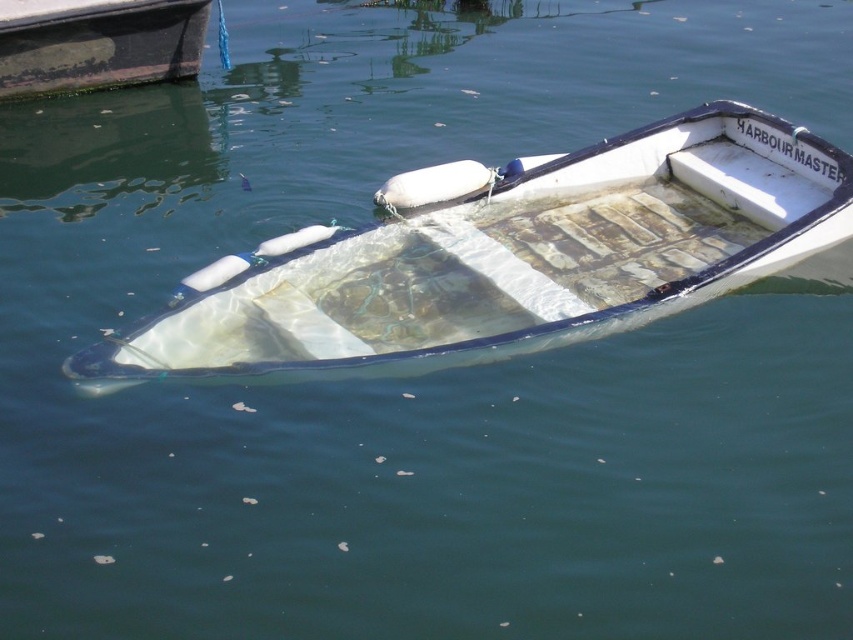
Question: Which object is farther from the camera taking this photo?

Choices:
 (A) rusty metal boat at upper left
 (B) transparent plastic boat at center

Answer: (A)

Question: Which point appears closest to the camera in this image?

Choices:
 (A) (15, 16)
 (B) (444, 179)

Answer: (B)

Question: Is transparent plastic boat at center positioned before rusty metal boat at upper left?

Choices:
 (A) yes
 (B) no

Answer: (A)

Question: Does transparent plastic boat at center come behind rusty metal boat at upper left?

Choices:
 (A) no
 (B) yes

Answer: (A)

Question: Can you confirm if transparent plastic boat at center is bigger than rusty metal boat at upper left?

Choices:
 (A) yes
 (B) no

Answer: (A)